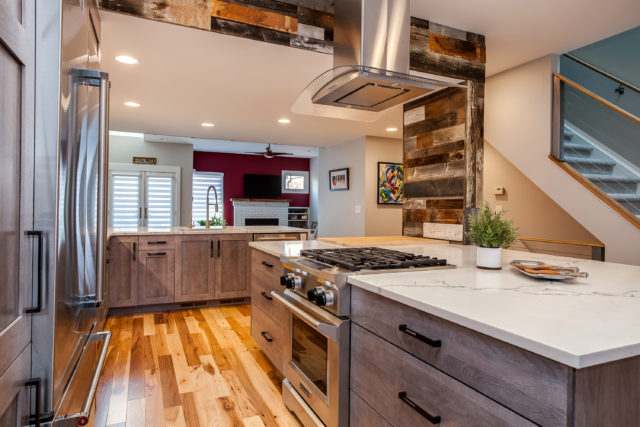
Identify the location of kitchen cabinet drawers. The width and height of the screenshot is (640, 427). (233, 258), (192, 266), (153, 274), (121, 264).